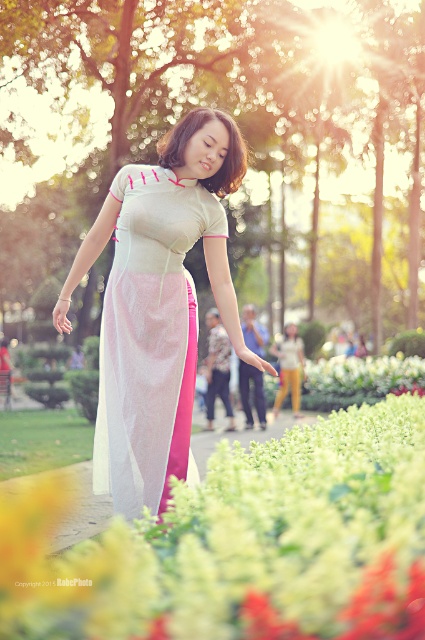
Question: Is translucent silk skirt at center wider than white sheer dress at center?

Choices:
 (A) yes
 (B) no

Answer: (A)

Question: Is translucent silk skirt at center below white sheer dress at center?

Choices:
 (A) yes
 (B) no

Answer: (A)

Question: Which object is closer to the camera taking this photo?

Choices:
 (A) white sheer dress at center
 (B) translucent silk skirt at center

Answer: (B)

Question: Among these points, which one is nearest to the camera?

Choices:
 (A) (200, 541)
 (B) (130, 237)

Answer: (A)

Question: Can you confirm if translucent silk skirt at center is positioned below white sheer dress at center?

Choices:
 (A) yes
 (B) no

Answer: (A)

Question: Which object is closer to the camera taking this photo?

Choices:
 (A) translucent silk skirt at center
 (B) white sheer dress at center

Answer: (A)